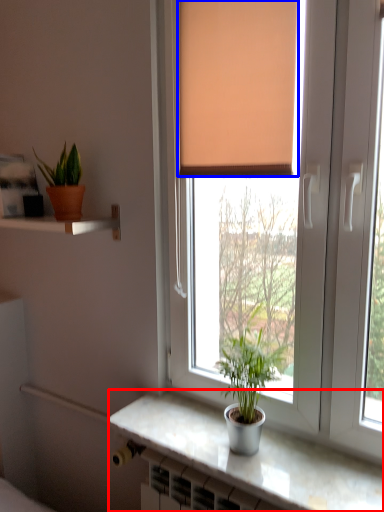
Question: Among these objects, which one is farthest to the camera, counter top (highlighted by a red box) or curtain (highlighted by a blue box)?

Choices:
 (A) counter top
 (B) curtain

Answer: (B)